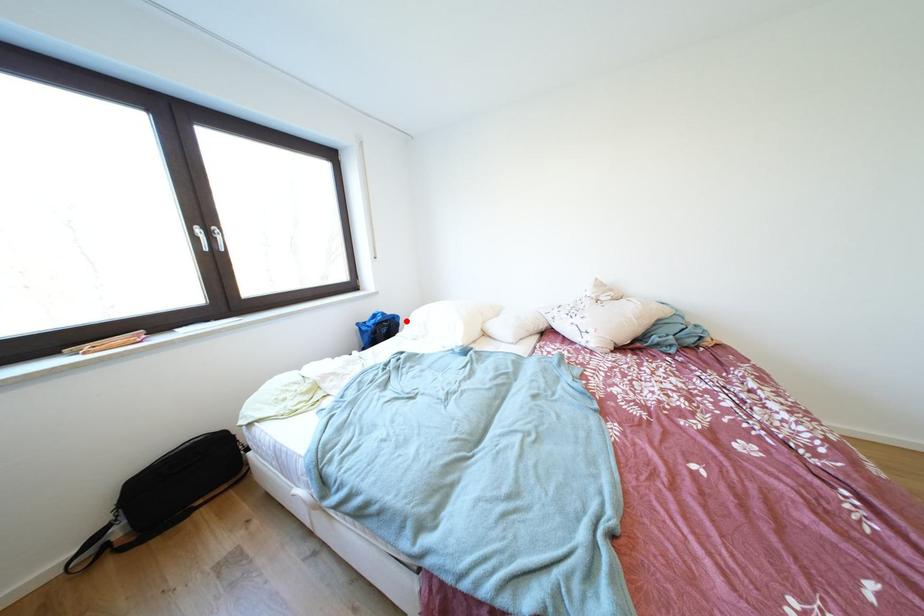
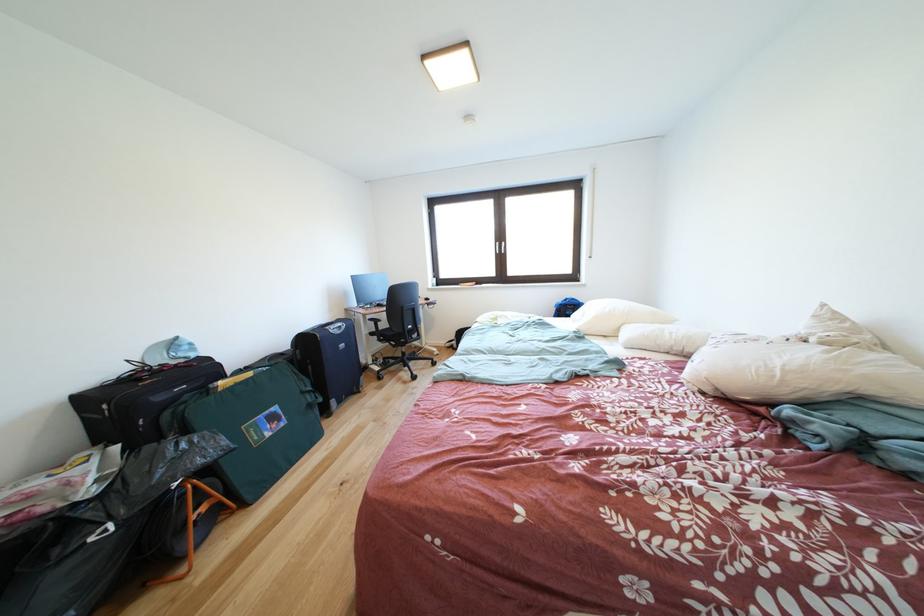
Where in the second image is the point corresponding to the highlighted location from the first image?

(591, 310)